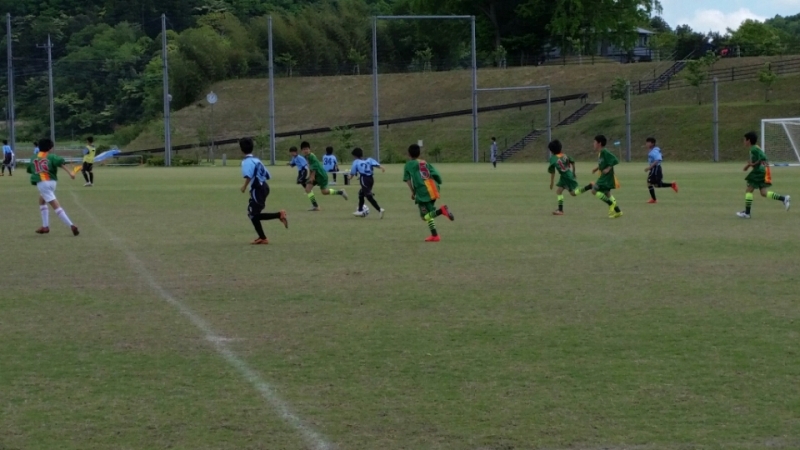
Locate an element on the screen. bottom of staircase is located at coordinates (500, 160).